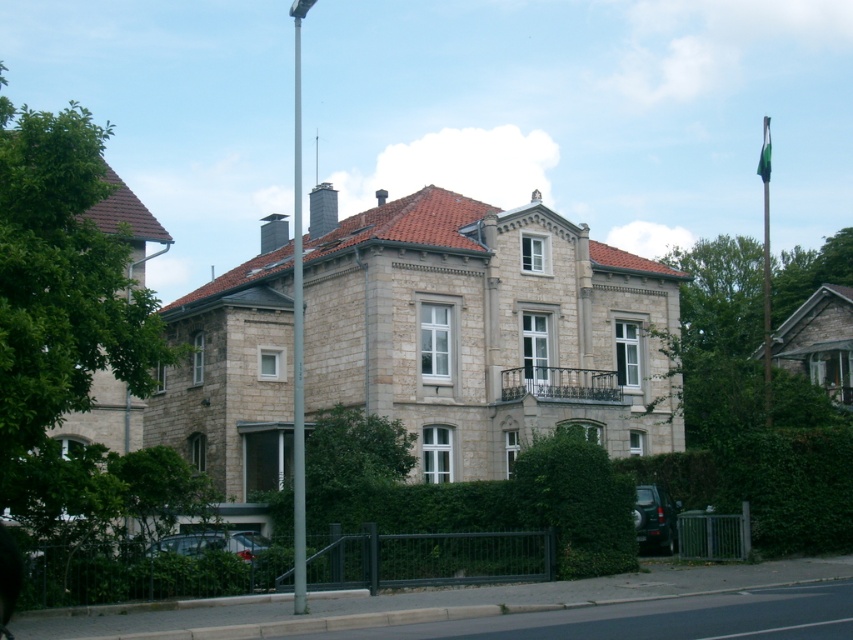
Question: Does metallic pole at center lie in front of metallic silver suv at lower right?

Choices:
 (A) no
 (B) yes

Answer: (B)

Question: Does metallic silver suv at lower right have a lesser width compared to green fabric flag pole at right?

Choices:
 (A) no
 (B) yes

Answer: (B)

Question: Based on their relative distances, which object is nearer to the green fabric flag pole at right?

Choices:
 (A) metallic pole at center
 (B) metallic silver suv at lower right

Answer: (A)

Question: Is metallic pole at center bigger than metallic silver suv at lower right?

Choices:
 (A) yes
 (B) no

Answer: (A)

Question: Which is farther from the metallic silver suv at lower right?

Choices:
 (A) green fabric flag pole at right
 (B) shiny metallic car at lower center
 (C) metallic pole at center

Answer: (C)

Question: Which object is positioned farthest from the green fabric flag pole at right?

Choices:
 (A) shiny metallic car at lower center
 (B) metallic silver suv at lower right

Answer: (B)